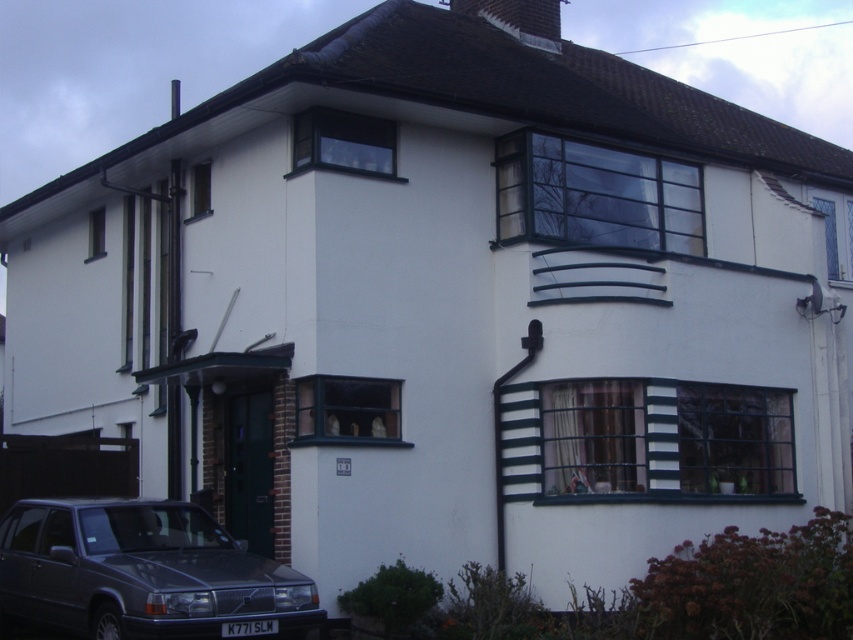
You are standing at the entrance of the house and want to park your car in the driveway. The driveway is located at the lower left corner of the house. According to the image, is the dark gray metallic car at lower left already occupying the driveway area?

The dark gray metallic car at lower left is located at point (143, 572), which is within the driveway area at the lower left corner of the house. Therefore, the driveway is already occupied by the dark gray metallic car at lower left.

You are a delivery person standing at the dark gray metallic car at lower left. You need to deliver a package to the house. The entrance is near the dark gray slate chimney at upper center. Can you walk directly to the entrance without going around any obstacles?

The distance between the dark gray metallic car at lower left and the dark gray slate chimney at upper center is 11.61 meters. Since there are no obstacles mentioned in the scene description, you can walk directly to the entrance near the dark gray slate chimney at upper center from the dark gray metallic car at lower left.